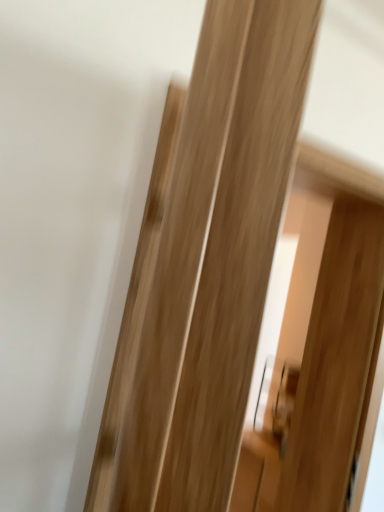
Question: In terms of size, does natural wood door at center appear bigger or smaller than natural wood screen door at center?

Choices:
 (A) small
 (B) big

Answer: (A)

Question: Considering their positions, is natural wood door at center located in front of or behind natural wood screen door at center?

Choices:
 (A) behind
 (B) front

Answer: (B)

Question: Is point (192, 194) positioned closer to the camera than point (370, 214)?

Choices:
 (A) farther
 (B) closer

Answer: (B)

Question: Is point (331, 462) closer or farther from the camera than point (241, 53)?

Choices:
 (A) farther
 (B) closer

Answer: (A)

Question: From their relative heights in the image, would you say natural wood screen door at center is taller or shorter than natural wood door at center?

Choices:
 (A) tall
 (B) short

Answer: (A)

Question: Would you say natural wood screen door at center is to the left or to the right of natural wood door at center in the picture?

Choices:
 (A) left
 (B) right

Answer: (B)

Question: Do you think natural wood screen door at center is within natural wood door at center, or outside of it?

Choices:
 (A) inside
 (B) outside

Answer: (B)